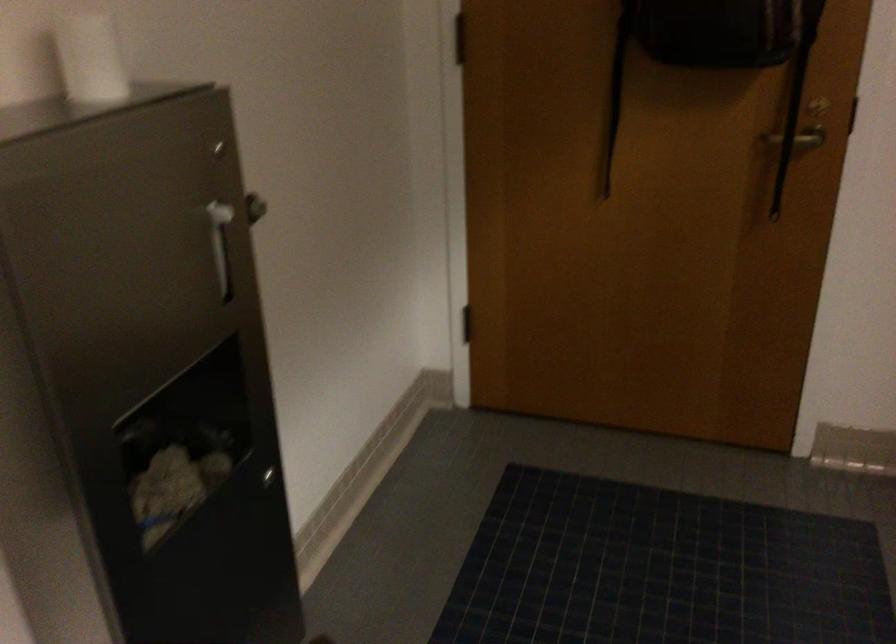
The width and height of the screenshot is (896, 644). Find the location of `metal dispenser handle`. metal dispenser handle is located at coordinates (220, 243).